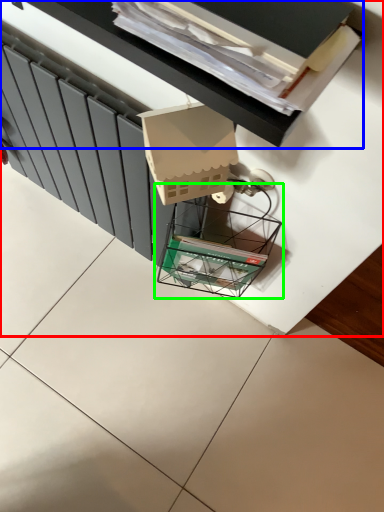
Question: Based on their relative distances, which object is farther from furniture (highlighted by a red box)? Choose from vanity (highlighted by a blue box) and glass box (highlighted by a green box).

Choices:
 (A) vanity
 (B) glass box

Answer: (A)